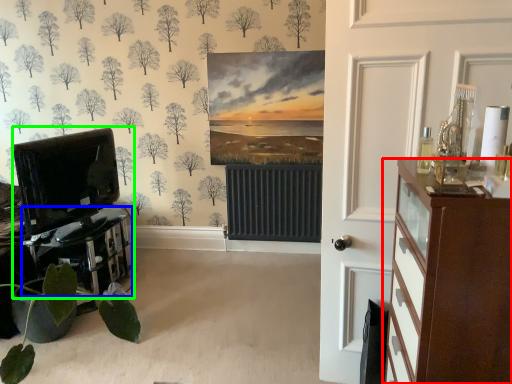
Question: Based on their relative distances, which object is nearer to chest of drawers (highlighted by a red box)? Choose from table (highlighted by a blue box) and entertainment center (highlighted by a green box).

Choices:
 (A) table
 (B) entertainment center

Answer: (A)